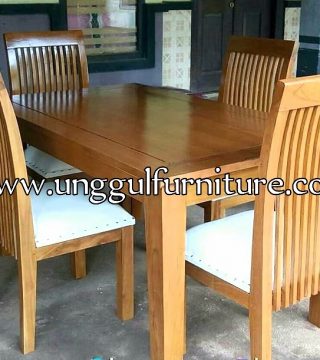
This screenshot has width=320, height=360. I want to click on cream floor, so click(293, 340).